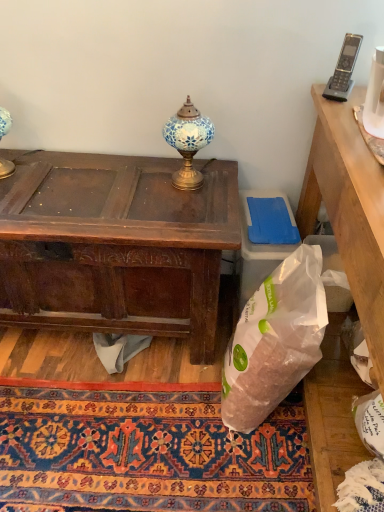
Question: Is white plastic trash bin/can at lower right further to the viewer compared to dark brown wood desk at center?

Choices:
 (A) yes
 (B) no

Answer: (A)

Question: Is white plastic trash bin/can at lower right closer to the viewer compared to dark brown wood desk at center?

Choices:
 (A) no
 (B) yes

Answer: (A)

Question: From a real-world perspective, is white plastic trash bin/can at lower right physically above dark brown wood desk at center?

Choices:
 (A) yes
 (B) no

Answer: (B)

Question: Is white plastic trash bin/can at lower right not within dark brown wood desk at center?

Choices:
 (A) yes
 (B) no

Answer: (A)

Question: Is white plastic trash bin/can at lower right wider than dark brown wood desk at center?

Choices:
 (A) yes
 (B) no

Answer: (B)

Question: Is dark brown wood desk at center located within white plastic trash bin/can at lower right?

Choices:
 (A) no
 (B) yes

Answer: (A)

Question: Is the position of white plastic trash bin/can at lower right more distant than that of blue mosaic lamp at center?

Choices:
 (A) no
 (B) yes

Answer: (B)

Question: Is white plastic trash bin/can at lower right smaller than blue mosaic lamp at center?

Choices:
 (A) yes
 (B) no

Answer: (B)

Question: Is white plastic trash bin/can at lower right positioned in front of blue mosaic lamp at center?

Choices:
 (A) no
 (B) yes

Answer: (A)

Question: Considering the relative positions of white plastic trash bin/can at lower right and blue mosaic lamp at center in the image provided, is white plastic trash bin/can at lower right to the right of blue mosaic lamp at center from the viewer's perspective?

Choices:
 (A) no
 (B) yes

Answer: (B)

Question: From the image's perspective, is white plastic trash bin/can at lower right located above blue mosaic lamp at center?

Choices:
 (A) no
 (B) yes

Answer: (A)

Question: Would you consider white plastic trash bin/can at lower right to be distant from blue mosaic lamp at center?

Choices:
 (A) no
 (B) yes

Answer: (A)

Question: Considering the relative sizes of carpet with intricate patterns at lower center and gray plastic phone at upper right in the image provided, is carpet with intricate patterns at lower center bigger than gray plastic phone at upper right?

Choices:
 (A) no
 (B) yes

Answer: (B)